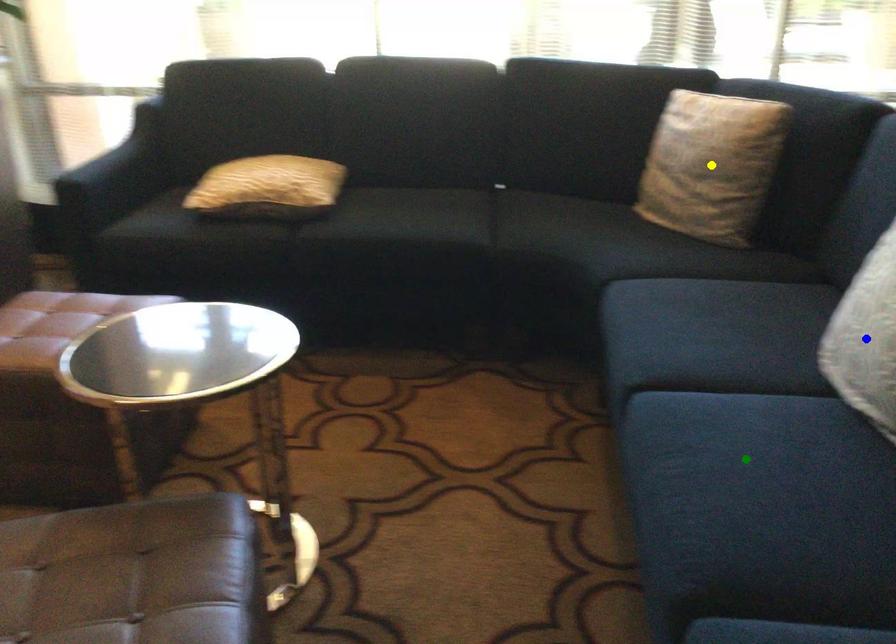
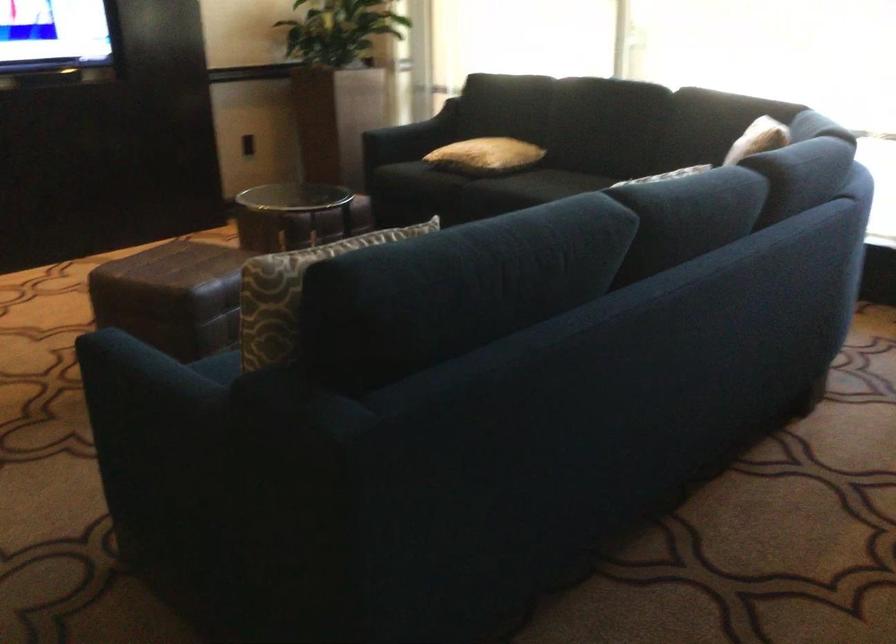
I am providing you with two images of the same scene from different viewpoints. Three points are marked in image1. Which point corresponds to a part or object that is occluded in image2?In image1, three points are marked. Which of them correspond to a part or object that is occluded in image2?Among the three points shown in image1, which one corresponds to a part or object that is no longer visible due to occlusion in image2?

Invisible in image2: green point, blue point, yellow point.